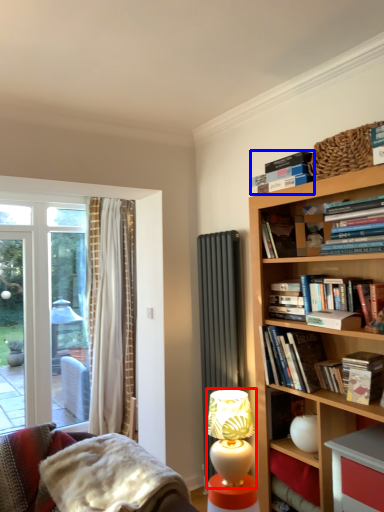
Question: Which object appears farthest to the camera in this image, table lamp (highlighted by a red box) or book (highlighted by a blue box)?

Choices:
 (A) table lamp
 (B) book

Answer: (A)